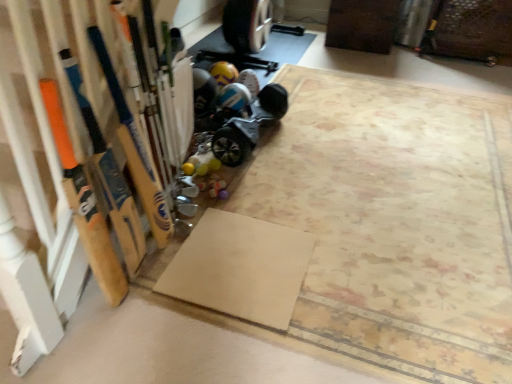
Locate an element on the screen. The width and height of the screenshot is (512, 384). vacant space behind beige matte yoga mat at lower center is located at coordinates (265, 195).